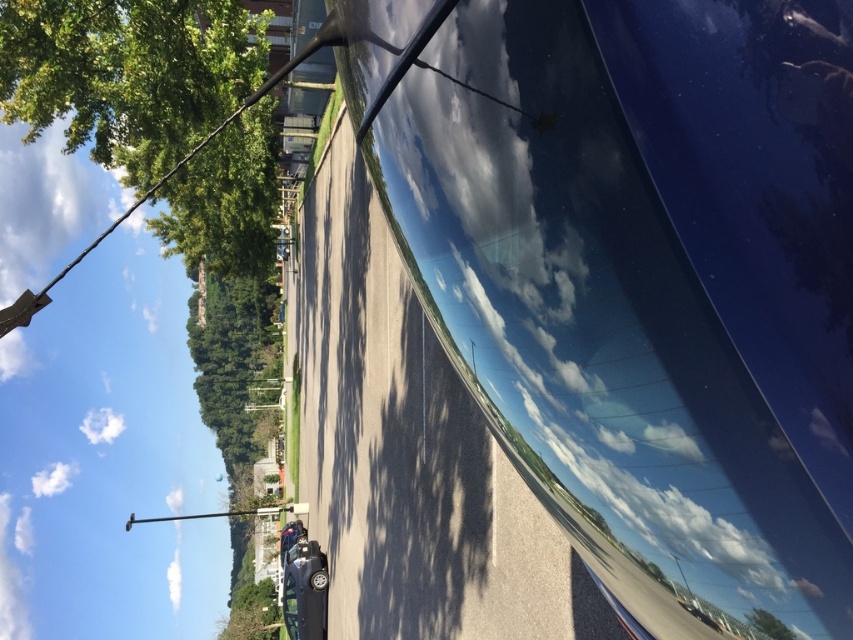
Between glossy blue car at center and green leafy tree at center, which one has more height?

green leafy tree at center

In the scene shown: Between glossy blue car at center and green leafy tree at center, which one appears on the left side from the viewer's perspective?

green leafy tree at center is more to the left.

Is point (755, 22) more distant than point (223, 397)?

No, (755, 22) is in front of (223, 397).

The height and width of the screenshot is (640, 853). What are the coordinates of `glossy blue car at center` in the screenshot? It's located at 641,275.

This screenshot has height=640, width=853. Find the location of `green leafy tree at upper left`. green leafy tree at upper left is located at coordinates (128, 74).

Based on the photo, can you confirm if glossy blue car at center is thinner than green leafy tree at upper left?

Indeed, glossy blue car at center has a lesser width compared to green leafy tree at upper left.

Which is behind, point (393, 49) or point (149, 58)?

The point (149, 58) is more distant.

What do you see at coordinates (641, 275) in the screenshot?
I see `glossy blue car at center` at bounding box center [641, 275].

The width and height of the screenshot is (853, 640). In order to click on glossy blue car at center in this screenshot , I will do `click(641, 275)`.